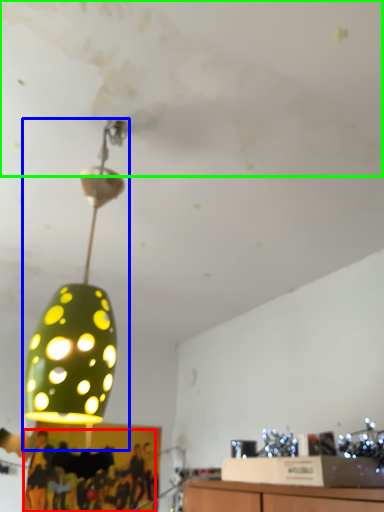
Question: Considering the real-world distances, which object is farthest from person (highlighted by a red box)? lamp (highlighted by a blue box) or cloud (highlighted by a green box)?

Choices:
 (A) lamp
 (B) cloud

Answer: (B)